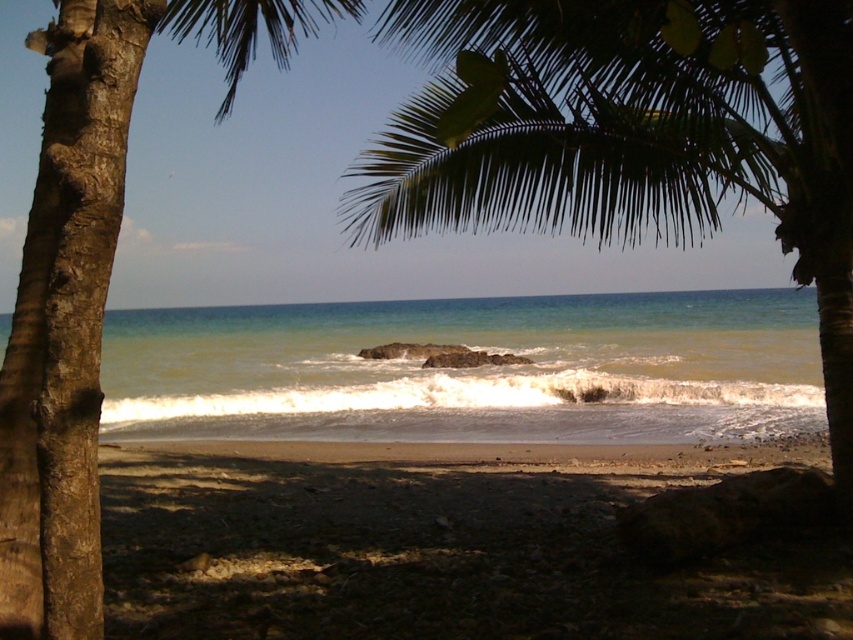
Question: Is green leafy palm tree at upper center bigger than brown rough bark palm tree at left?

Choices:
 (A) no
 (B) yes

Answer: (A)

Question: Does green leafy palm tree at upper center have a smaller size compared to brown rough bark palm tree at left?

Choices:
 (A) yes
 (B) no

Answer: (A)

Question: Which of these objects is positioned farthest from the green leafy palm tree at upper center?

Choices:
 (A) brown rough bark palm tree at left
 (B) greenish-blue water at center

Answer: (B)

Question: Which point is closer to the camera taking this photo?

Choices:
 (A) (39, 440)
 (B) (440, 323)
 (C) (693, 93)

Answer: (A)

Question: Considering the relative positions of green leafy palm tree at upper center and greenish-blue water at center in the image provided, where is green leafy palm tree at upper center located with respect to greenish-blue water at center?

Choices:
 (A) right
 (B) left

Answer: (B)

Question: Considering the real-world distances, which object is closest to the brown rough bark palm tree at left?

Choices:
 (A) greenish-blue water at center
 (B) green leafy palm tree at upper center

Answer: (B)